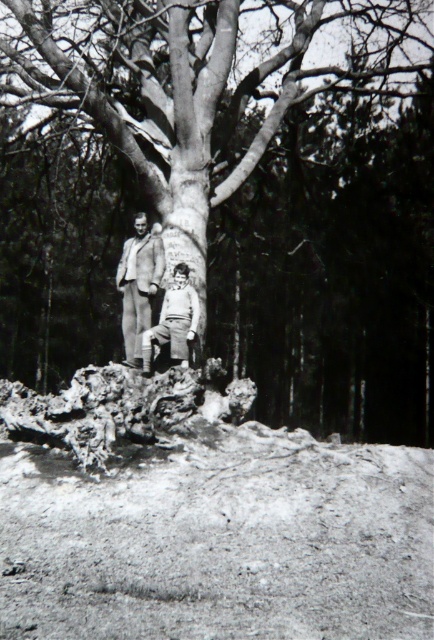
Which of these two, smooth bark tree trunk at center or light brown fabric pants at center, stands shorter?

light brown fabric pants at center

Is smooth bark tree trunk at center further to camera compared to light brown fabric pants at center?

Yes, smooth bark tree trunk at center is behind light brown fabric pants at center.

Does point (153, 128) come behind point (190, 298)?

That is True.

Identify the location of smooth bark tree trunk at center. (229, 193).

Who is positioned more to the left, light brown wool coat at center or light brown fabric pants at center?

light brown wool coat at center is more to the left.

Does light brown wool coat at center come behind light brown fabric pants at center?

That is True.

The width and height of the screenshot is (434, 640). In order to click on light brown wool coat at center in this screenshot , I will do `click(138, 284)`.

Find the location of a particular element. The height and width of the screenshot is (640, 434). light brown wool coat at center is located at coordinates (138, 284).

Between point (280, 102) and point (124, 289), which one is positioned behind?

Point (280, 102)

Who is taller, smooth bark tree trunk at center or light brown wool coat at center?

smooth bark tree trunk at center

Between point (401, 348) and point (124, 349), which one is positioned in front?

Point (124, 349)

Find the location of `smooth bark tree trunk at center`. smooth bark tree trunk at center is located at coordinates (229, 193).